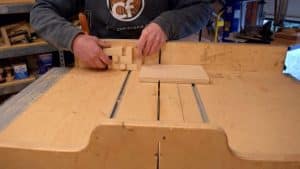
Find the location of a particular element. The image size is (300, 169). shelves in background is located at coordinates click(x=10, y=85), click(x=11, y=55).